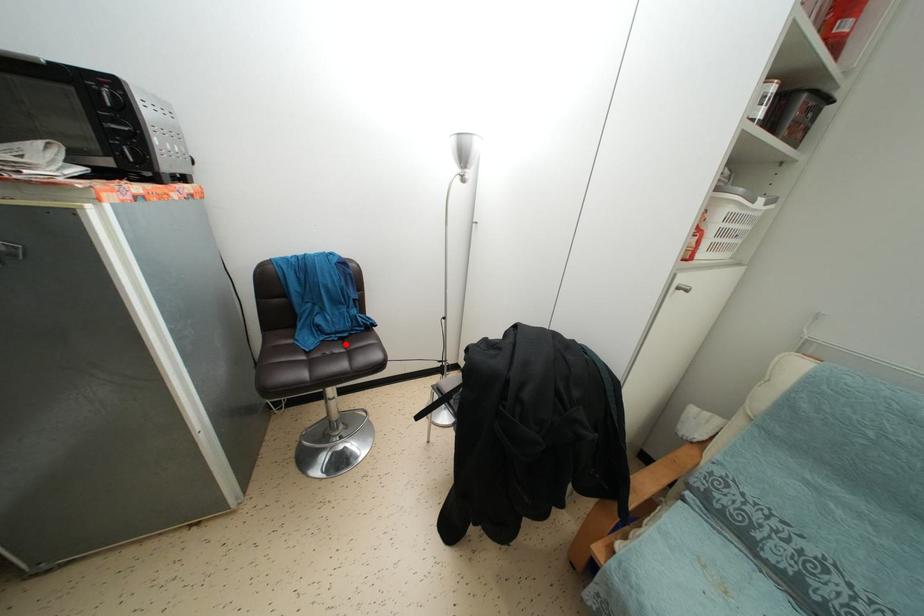
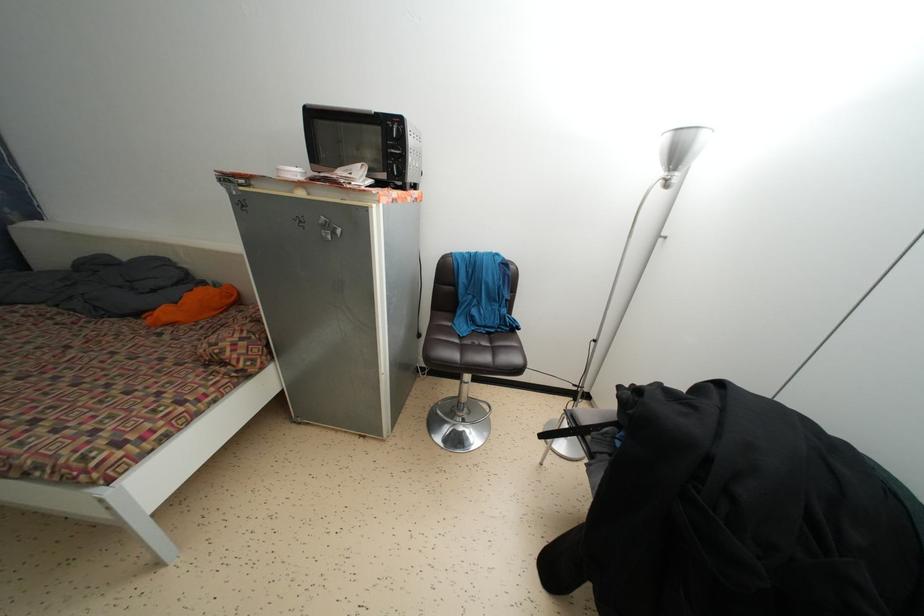
In the second image, find the point that corresponds to the highlighted location in the first image.

(492, 339)